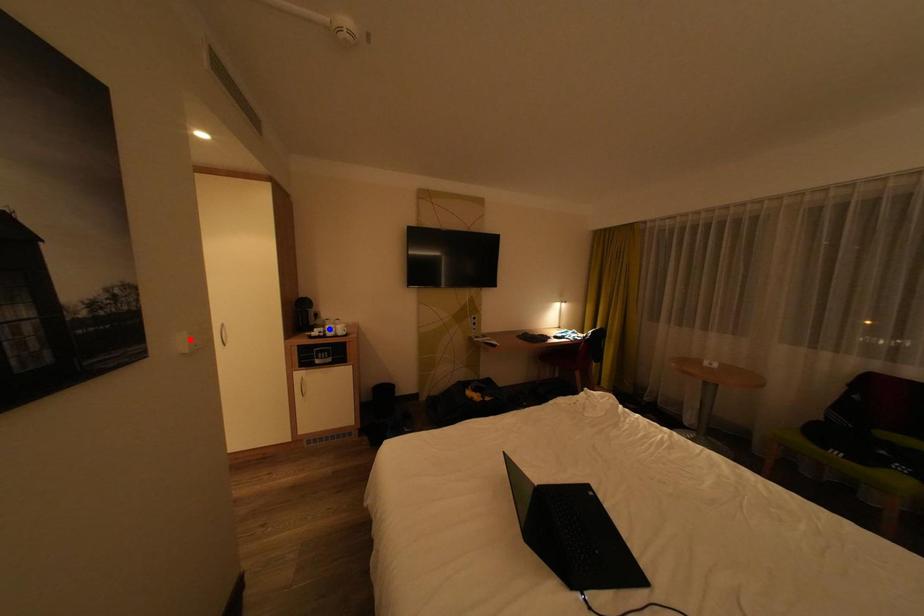
Question: In the image, two points are highlighted. Which point is nearer to the camera? Reply with the corresponding letter.

Choices:
 (A) blue point
 (B) red point

Answer: (B)